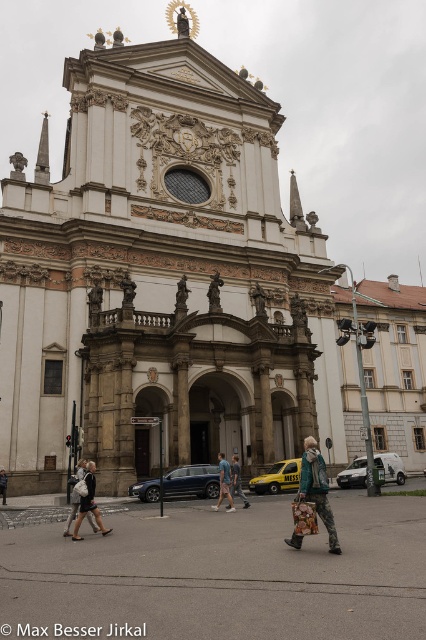
You are standing 50 meters away from the grand cathedral. You want to reach the point marked at coordinates point (x=207, y=337). Will you have to walk forward or backward to get there?

The point (x=207, y=337) is located 53.91 meters away from the viewer. Since you are currently 50 meters away, you need to walk forward an additional 3.91 meters to reach it.

Based on the photo, you are standing in front of the white stone church at center and the gray asphalt at center. Which object takes up more space in the image?

The white stone church at center is larger in size than the gray asphalt at center, so it takes up more space in the image.